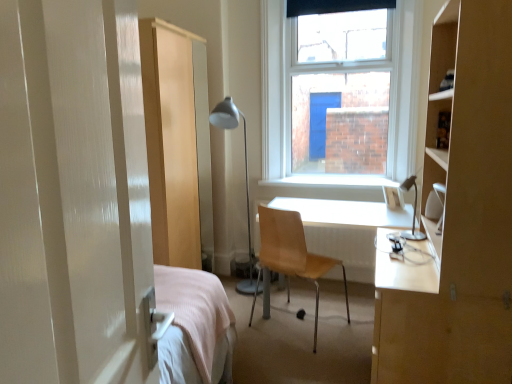
Question: From a real-world perspective, is matte silver floor lamp at center, the second table lamp in the front-to-back sequence, positioned over white smooth window sill at center based on gravity?

Choices:
 (A) no
 (B) yes

Answer: (A)

Question: From the image's perspective, would you say matte silver floor lamp at center, the second table lamp in the front-to-back sequence, is shown under white smooth window sill at center?

Choices:
 (A) no
 (B) yes

Answer: (B)

Question: Is matte silver floor lamp at center, which is counted as the 1th table lamp, starting from the back, behind white smooth window sill at center?

Choices:
 (A) yes
 (B) no

Answer: (B)

Question: From a real-world perspective, is matte silver floor lamp at center, the second table lamp in the front-to-back sequence, beneath white smooth window sill at center?

Choices:
 (A) no
 (B) yes

Answer: (B)

Question: Is matte silver floor lamp at center, which is the 2th table lamp from right to left, positioned beyond the bounds of white smooth window sill at center?

Choices:
 (A) yes
 (B) no

Answer: (A)

Question: Is matte silver floor lamp at center, which appears as the first table lamp when viewed from the left, at the right side of white smooth window sill at center?

Choices:
 (A) no
 (B) yes

Answer: (A)

Question: Can you confirm if white smooth window sill at center is smaller than matte silver table lamp at right, the second table lamp from the left?

Choices:
 (A) yes
 (B) no

Answer: (B)

Question: Does white smooth window sill at center appear on the left side of matte silver table lamp at right, the second table lamp from the left?

Choices:
 (A) no
 (B) yes

Answer: (B)

Question: From the image's perspective, is white smooth window sill at center located beneath matte silver table lamp at right, arranged as the 1th table lamp when viewed from the front?

Choices:
 (A) no
 (B) yes

Answer: (A)

Question: From a real-world perspective, is white smooth window sill at center physically below matte silver table lamp at right, the 1th table lamp viewed from the right?

Choices:
 (A) no
 (B) yes

Answer: (B)

Question: Does white smooth window sill at center have a lesser height compared to matte silver table lamp at right, the 1th table lamp viewed from the right?

Choices:
 (A) yes
 (B) no

Answer: (A)

Question: Is white smooth window sill at center closer to the viewer compared to matte silver table lamp at right, arranged as the 1th table lamp when viewed from the front?

Choices:
 (A) yes
 (B) no

Answer: (B)

Question: Is wooden chair at center surrounding white glossy desk at center?

Choices:
 (A) yes
 (B) no

Answer: (A)